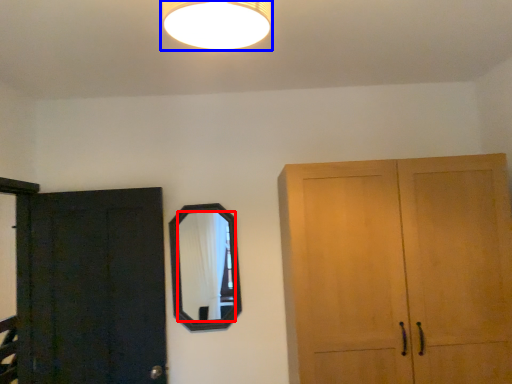
Question: Which of the following is the farthest to the observer, mirror (highlighted by a red box) or lamp (highlighted by a blue box)?

Choices:
 (A) mirror
 (B) lamp

Answer: (A)